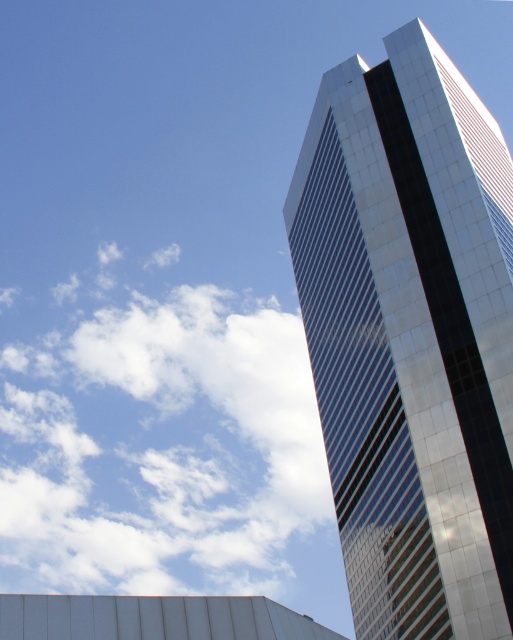
Can you confirm if glossy glass tower at upper right is shorter than white fluffy cloud at upper left?

Yes.

Between point (489, 333) and point (111, 422), which one is positioned in front?

Point (489, 333) is in front.

Locate an element on the screen. This screenshot has height=640, width=513. glossy glass tower at upper right is located at coordinates (410, 337).